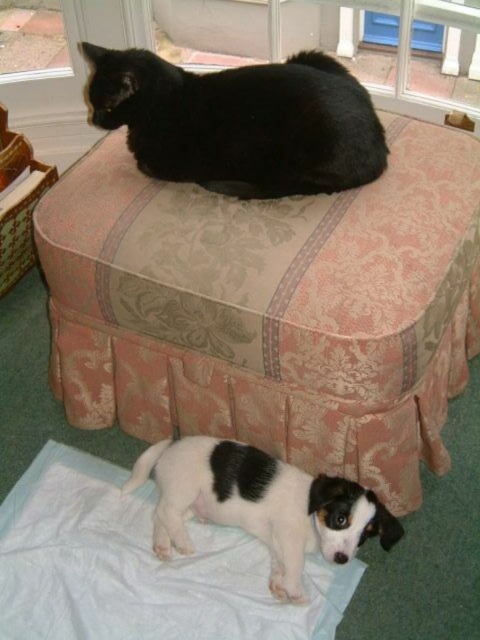
Is pink damask ottoman at upper center thinner than white-furred dog at lower left?

No.

Is pink damask ottoman at upper center smaller than white-furred dog at lower left?

No.

Between point (355, 276) and point (220, 518), which one is positioned in front?

Point (355, 276) is more forward.

Locate an element on the screen. The height and width of the screenshot is (640, 480). pink damask ottoman at upper center is located at coordinates [x=272, y=307].

Is black fur cat at upper center wider than white-furred dog at lower left?

Yes, black fur cat at upper center is wider than white-furred dog at lower left.

Which is above, black fur cat at upper center or white-furred dog at lower left?

black fur cat at upper center is above.

Does point (305, 74) come farther from viewer compared to point (201, 490)?

That is False.

Image resolution: width=480 pixels, height=640 pixels. I want to click on black fur cat at upper center, so click(240, 122).

Does point (133, 272) lie behind point (248, 109)?

That is False.

Between pink damask ottoman at upper center and black fur cat at upper center, which one has less height?

Standing shorter between the two is black fur cat at upper center.

Is point (152, 388) positioned in front of point (238, 115)?

No, (152, 388) is behind (238, 115).

You are a GUI agent. You are given a task and a screenshot of the screen. Output one action in this format:
    pyautogui.click(x=<x>, y=<y>)
    Task: Click on the pink damask ottoman at upper center
    The height and width of the screenshot is (640, 480).
    Given the screenshot: What is the action you would take?
    pyautogui.click(x=272, y=307)